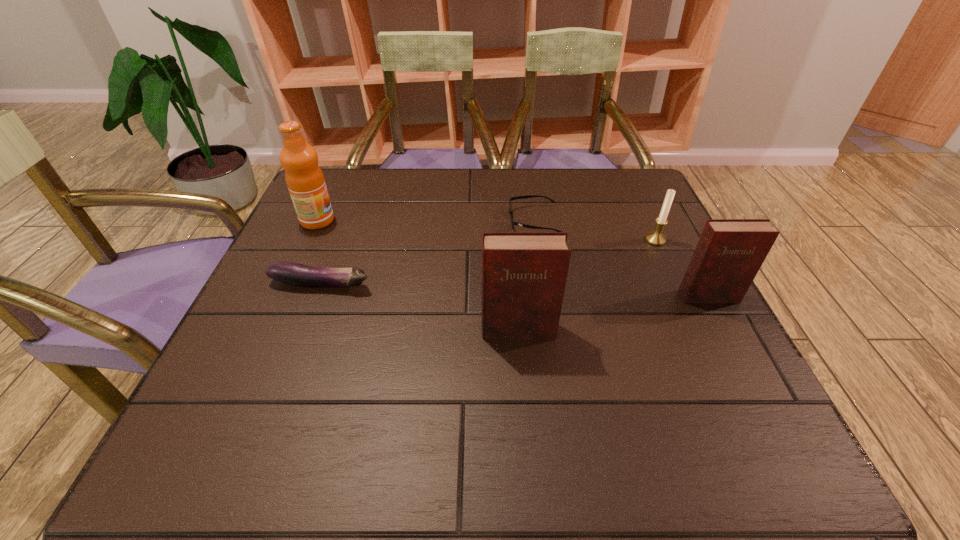
In order to click on vacant point located 0.370m on the front of the candle holder in this screenshot , I will do `click(719, 375)`.

Locate an element on the screen. vacant space located 0.080m on the front-facing side of the sunglasses is located at coordinates (477, 220).

You are a GUI agent. You are given a task and a screenshot of the screen. Output one action in this format:
    pyautogui.click(x=<x>, y=<y>)
    Task: Click on the free point located 0.220m on the front-facing side of the sunglasses
    The height and width of the screenshot is (540, 960).
    Given the screenshot: What is the action you would take?
    pyautogui.click(x=423, y=220)

At what (x,y) coordinates should I click in order to perform the action: click on vacant area located on the front-facing side of the sunglasses. Please return your answer as a coordinate pair (x, y). Looking at the image, I should click on (443, 220).

Where is `blank space located on the label side of the fruit juice`? Image resolution: width=960 pixels, height=540 pixels. blank space located on the label side of the fruit juice is located at coordinates pyautogui.click(x=427, y=221).

You are a GUI agent. You are given a task and a screenshot of the screen. Output one action in this format:
    pyautogui.click(x=<x>, y=<y>)
    Task: Click on the vacant space situated on the right of the second shortest object
    This screenshot has height=540, width=960.
    Given the screenshot: What is the action you would take?
    pyautogui.click(x=431, y=284)

The height and width of the screenshot is (540, 960). I want to click on sunglasses that is at the far edge, so click(512, 222).

Find the location of a particular element. The height and width of the screenshot is (540, 960). fruit juice that is at the far edge is located at coordinates (304, 178).

The image size is (960, 540). I want to click on fruit juice that is at the left edge, so click(304, 178).

This screenshot has height=540, width=960. I want to click on eggplant that is at the left edge, so click(291, 273).